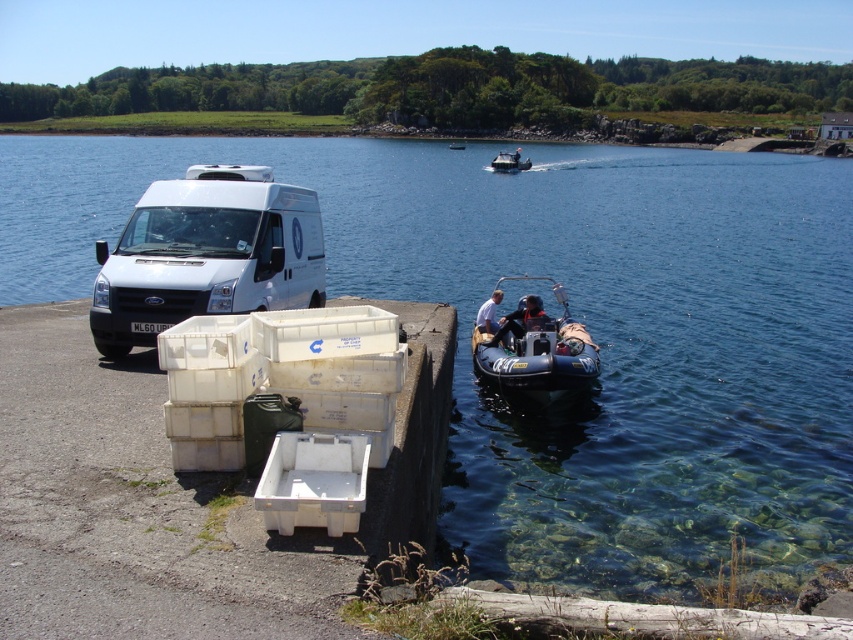
Does point (770, 172) come behind point (505, 157)?

Yes, point (770, 172) is farther from viewer.

Does clear blue water at center have a greater height compared to black rubber dinghy at center?

Yes, clear blue water at center is taller than black rubber dinghy at center.

Between point (743, 502) and point (514, 164), which one is positioned in front?

Point (743, 502) is in front.

I want to click on clear blue water at center, so click(573, 316).

Is clear blue water at center taller than white rubber dinghy at center?

Yes, clear blue water at center is taller than white rubber dinghy at center.

Describe the element at coordinates (573, 316) in the screenshot. I see `clear blue water at center` at that location.

Locate an element on the screen. Image resolution: width=853 pixels, height=640 pixels. clear blue water at center is located at coordinates (573, 316).

Which is in front, point (262, 292) or point (544, 362)?

Point (262, 292) is more forward.

Is white matte van at left below blue rubber boat at center?

No, white matte van at left is not below blue rubber boat at center.

Find the location of `white matte van at left`. white matte van at left is located at coordinates (207, 253).